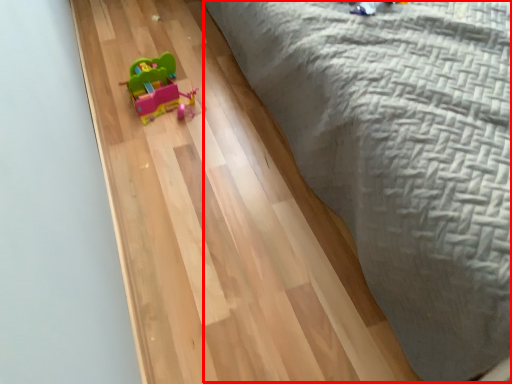
Question: Considering the relative positions of bed (annotated by the red box) and toy in the image provided, where is bed (annotated by the red box) located with respect to the staircase?

Choices:
 (A) left
 (B) right

Answer: (B)